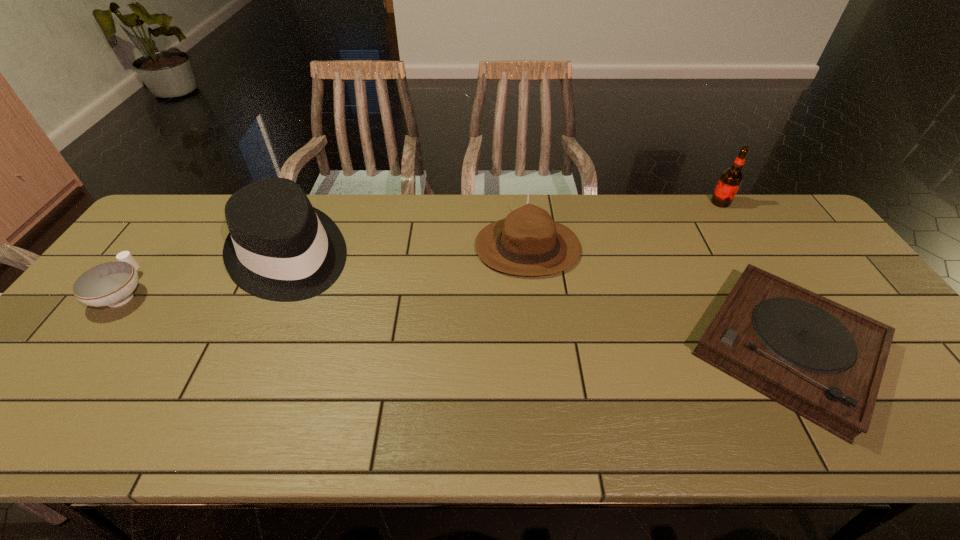
Where is `object that is positioned at the near right corner`? The width and height of the screenshot is (960, 540). object that is positioned at the near right corner is located at coordinates (824, 361).

Find the location of a particular element. This screenshot has height=540, width=960. vacant region at the far edge is located at coordinates (354, 224).

In the image, there is a desktop. Where is `free region at the near edge`? free region at the near edge is located at coordinates (94, 408).

Image resolution: width=960 pixels, height=540 pixels. In order to click on vacant space at the right edge of the desktop in this screenshot , I will do `click(848, 299)`.

Where is `free space at the far left corner of the desktop`? free space at the far left corner of the desktop is located at coordinates (161, 226).

Locate an element on the screen. vacant area at the near left corner of the desktop is located at coordinates (60, 437).

The image size is (960, 540). In order to click on vacant space at the far right corner of the desktop in this screenshot , I will do `click(754, 195)`.

The width and height of the screenshot is (960, 540). I want to click on empty space between the phonograph record and the shorter fedora, so click(x=658, y=298).

Locate an element on the screen. This screenshot has height=540, width=960. blank region between the phonograph record and the chinaware is located at coordinates (455, 321).

You are a GUI agent. You are given a task and a screenshot of the screen. Output one action in this format:
    pyautogui.click(x=<x>, y=<y>)
    Task: Click on the free area in between the root beer and the chinaware
    
    Given the screenshot: What is the action you would take?
    (x=422, y=248)